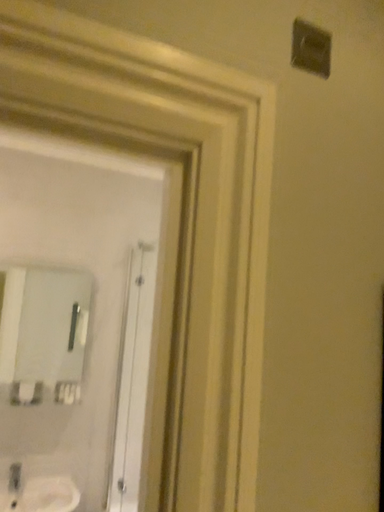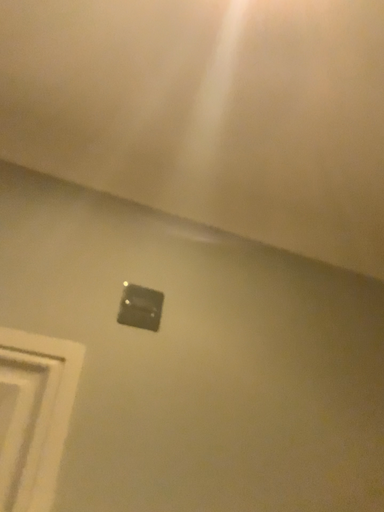
Question: How did the camera likely rotate when shooting the video?

Choices:
 (A) rotated upward
 (B) rotated downward

Answer: (A)